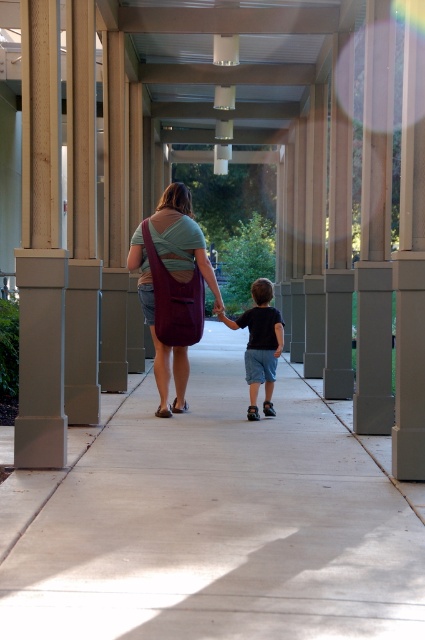
Does smooth gray pillar at left lie behind dark blue cotton shorts at center?

No, it is not.

In the scene shown: Can you confirm if smooth gray pillar at left is smaller than dark blue cotton shorts at center?

Indeed, smooth gray pillar at left has a smaller size compared to dark blue cotton shorts at center.

Identify the location of smooth gray pillar at left. This screenshot has width=425, height=640. (40, 246).

What do you see at coordinates (181, 237) in the screenshot? I see `matte purple bag at center` at bounding box center [181, 237].

Between matte purple bag at center and dark blue cotton shorts at center, which one is positioned higher?

Positioned higher is matte purple bag at center.

Which is in front, point (150, 227) or point (254, 326)?

Point (150, 227) is in front.

Find the location of `matte purple bag at center`. matte purple bag at center is located at coordinates (181, 237).

Who is taller, smooth gray pillar at left or matte purple bag at center?

smooth gray pillar at left is taller.

From the picture: Can you confirm if smooth gray pillar at left is shorter than matte purple bag at center?

In fact, smooth gray pillar at left may be taller than matte purple bag at center.

Measure the distance between smooth gray pillar at left and camera.

20.06 feet

The width and height of the screenshot is (425, 640). Identify the location of smooth gray pillar at left. (40, 246).